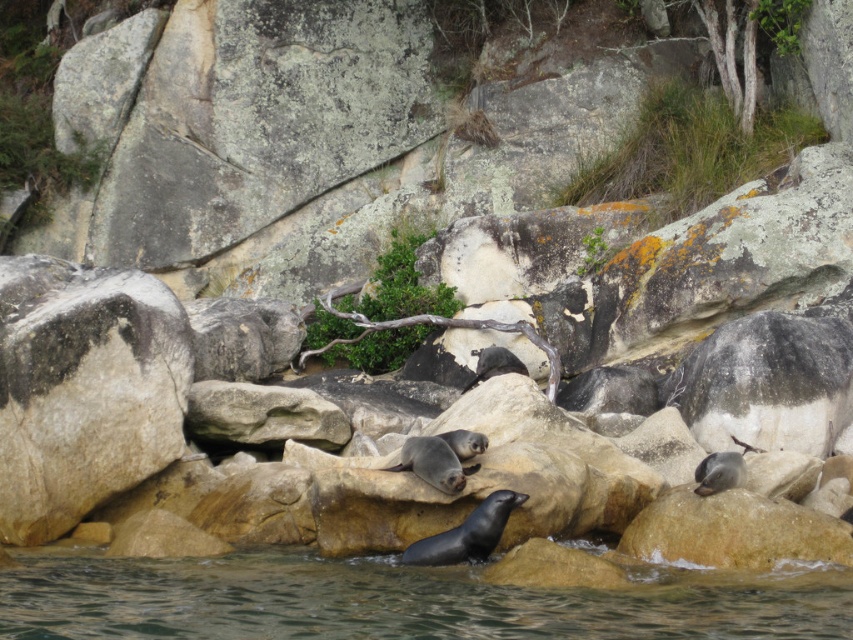
Which is more to the right, clear water at lower center or gray rough rock at left?

clear water at lower center

This screenshot has width=853, height=640. Describe the element at coordinates (396, 600) in the screenshot. I see `clear water at lower center` at that location.

Where is `clear water at lower center`? The image size is (853, 640). clear water at lower center is located at coordinates pos(396,600).